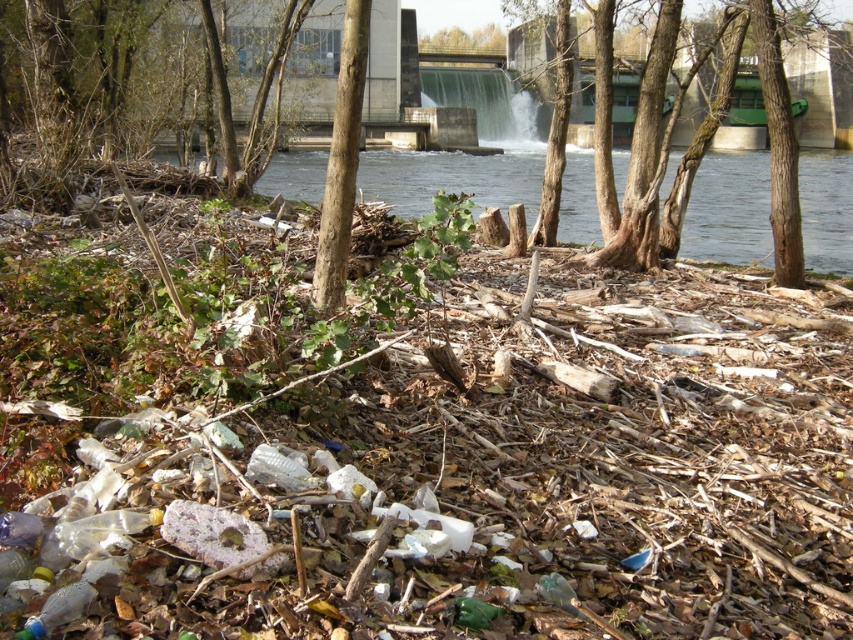
Based on the scene described, which tree at upper center is taller, the brown wood tree at upper center or the green leafy tree at upper center?

The brown wood tree at upper center is taller than the green leafy tree at upper center according to the description.

You are a park ranger assessing the area. You notice the smooth bark tree at center and the green leafy tree at upper center. Which tree is positioned higher in the scene?

The green leafy tree at upper center is positioned higher in the scene than the smooth bark tree at center.

You are a park ranger assessing the health of trees in this degraded area. You notice two trees, the brown wood tree at upper center and the smooth bark tree at center. Which tree takes up more space in the scene?

The smooth bark tree at center occupies more space than the brown wood tree at upper center.